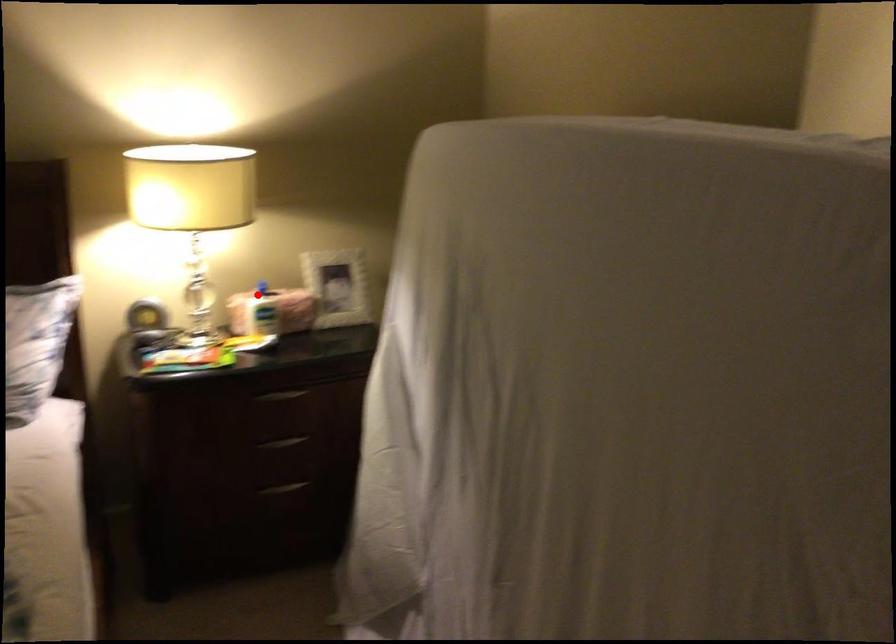
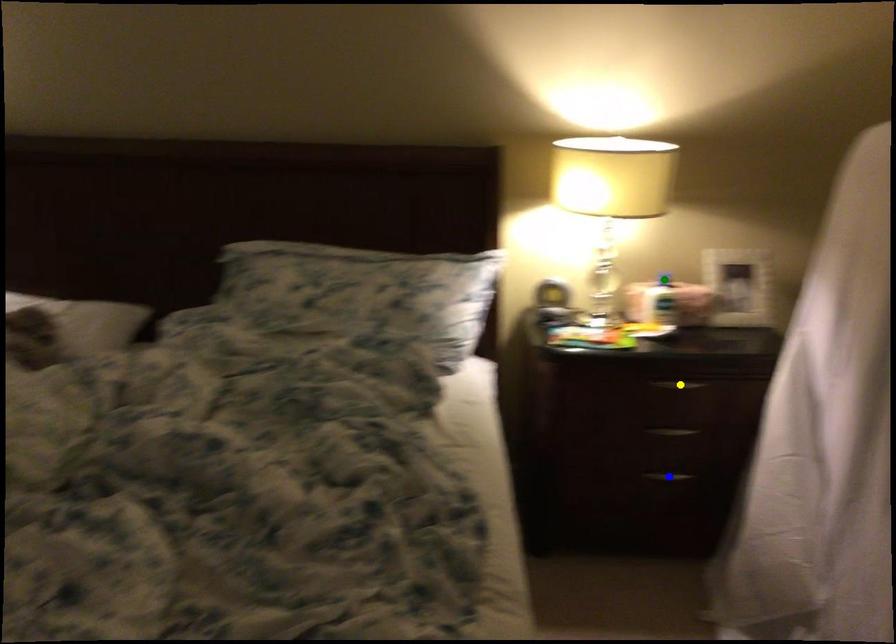
Question: I am providing you with two images of the same scene from different viewpoints. A red point is marked on the first image. You are given multiple points on the second image. Can you choose the point in image 2 that corresponds to the point in image 1?

Choices:
 (A) green point
 (B) yellow point
 (C) blue point

Answer: (A)